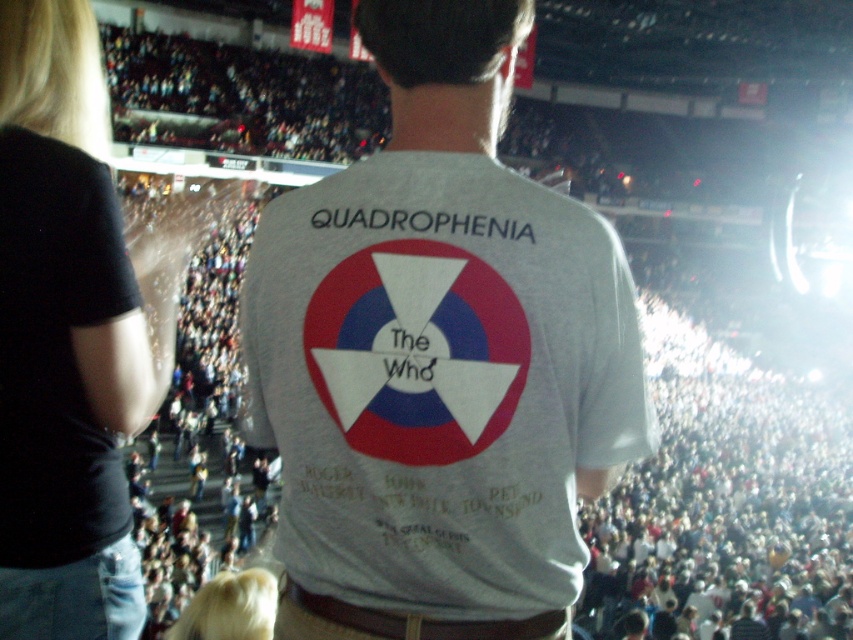
Question: Is white cotton t-shirt at center smaller than black cotton shirt at upper left?

Choices:
 (A) no
 (B) yes

Answer: (B)

Question: Can you confirm if white cotton t-shirt at center is positioned above black cotton shirt at upper left?

Choices:
 (A) yes
 (B) no

Answer: (A)

Question: Is white cotton t-shirt at center closer to the viewer compared to black cotton shirt at upper left?

Choices:
 (A) yes
 (B) no

Answer: (B)